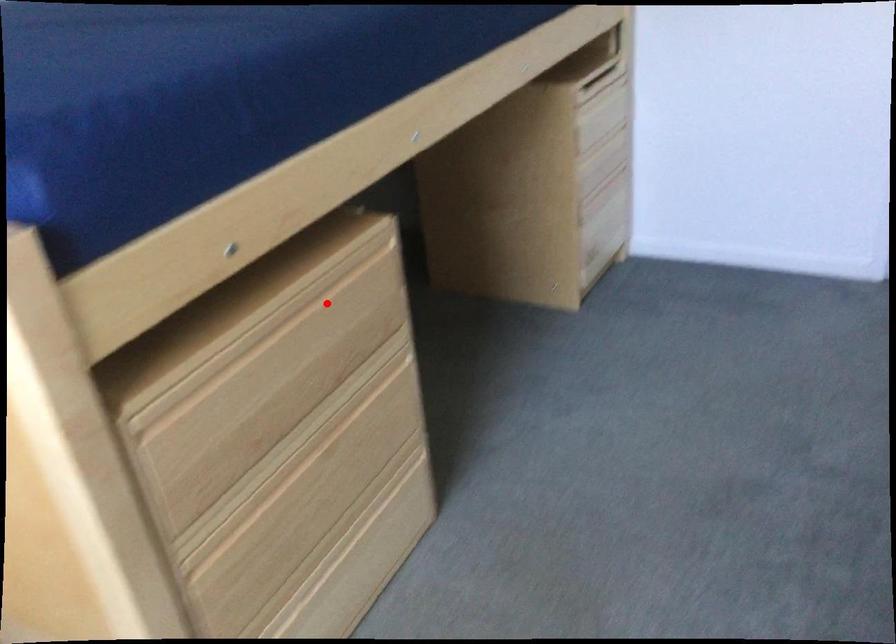
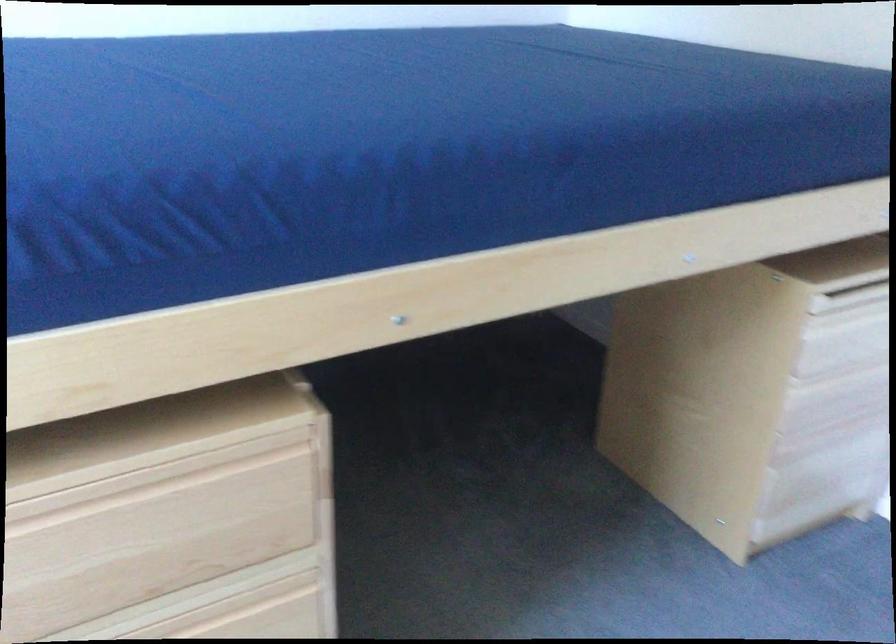
Question: I am providing you with two images of the same scene from different viewpoints. In image1, a red point is highlighted. Considering the same 3D point in image2, which of the following is correct?

Choices:
 (A) It is closer
 (B) It is farther

Answer: (A)